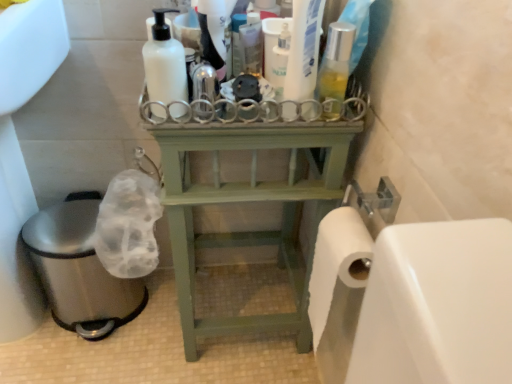
Measure the distance between point (314, 74) and camera.

Point (314, 74) and camera are 27.52 inches apart from each other.

Measure the distance between translucent plastic bottle at upper center, the 3th cleaning product when ordered from left to right, and camera.

A distance of 65.20 centimeters exists between translucent plastic bottle at upper center, the 3th cleaning product when ordered from left to right, and camera.

At what (x,y) coordinates should I click in order to perform the action: click on translucent plastic bottle at center, placed as the 4th cleaning product when sorted from left to right. Please return your answer as a coordinate pair (x, y). Looking at the image, I should click on (303, 50).

Which object is closer to the camera taking this photo, white matte bottle at upper center, which appears as the fourth cleaning product when viewed from the right, or translucent plastic bottle at upper center, which appears as the second cleaning product when viewed from the right?

white matte bottle at upper center, which appears as the fourth cleaning product when viewed from the right, is in front.

Is point (144, 45) less distant than point (280, 96)?

No, (144, 45) is further to viewer.

Is white matte bottle at upper center, the first cleaning product when ordered from left to right, facing towards translucent plastic bottle at upper center, which appears as the second cleaning product when viewed from the right?

No, white matte bottle at upper center, the first cleaning product when ordered from left to right, is not aimed at translucent plastic bottle at upper center, which appears as the second cleaning product when viewed from the right.

Is white matte bottle at upper center, the first cleaning product when ordered from left to right, smaller than translucent plastic bottle at upper center, which appears as the second cleaning product when viewed from the right?

No, white matte bottle at upper center, the first cleaning product when ordered from left to right, is not smaller than translucent plastic bottle at upper center, which appears as the second cleaning product when viewed from the right.

Can you confirm if translucent plastic bottle at center, placed as the 4th cleaning product when sorted from left to right, is bigger than translucent plastic spray bottle at center, which appears as the second cleaning product when viewed from the left?

Correct, translucent plastic bottle at center, placed as the 4th cleaning product when sorted from left to right, is larger in size than translucent plastic spray bottle at center, which appears as the second cleaning product when viewed from the left.

Would you consider translucent plastic bottle at center, placed as the 4th cleaning product when sorted from left to right, to be distant from translucent plastic spray bottle at center, which appears as the second cleaning product when viewed from the left?

No, there isn't a large distance between translucent plastic bottle at center, placed as the 4th cleaning product when sorted from left to right, and translucent plastic spray bottle at center, which appears as the second cleaning product when viewed from the left.

Does translucent plastic bottle at center, placed as the 4th cleaning product when sorted from left to right, have a greater width compared to translucent plastic spray bottle at center, which appears as the second cleaning product when viewed from the left?

No, translucent plastic bottle at center, placed as the 4th cleaning product when sorted from left to right, is not wider than translucent plastic spray bottle at center, which appears as the second cleaning product when viewed from the left.

Is translucent plastic bottle at center, the first cleaning product from the right, completely or partially outside of translucent plastic spray bottle at center, which appears as the second cleaning product when viewed from the left?

That's correct, translucent plastic bottle at center, the first cleaning product from the right, is outside of translucent plastic spray bottle at center, which appears as the second cleaning product when viewed from the left.

Locate an element on the screen. cleaning product that is the 2nd object directly below the translucent plastic spray bottle at center, which is the 3th cleaning product from right to left (from a real-world perspective) is located at coordinates (164, 63).

Considering the positions of points (209, 2) and (163, 22), is point (209, 2) farther from camera compared to point (163, 22)?

Yes.

Considering the positions of objects translucent plastic spray bottle at center, which is the 3th cleaning product from right to left, and white matte bottle at upper center, the first cleaning product when ordered from left to right, in the image provided, who is behind, translucent plastic spray bottle at center, which is the 3th cleaning product from right to left, or white matte bottle at upper center, the first cleaning product when ordered from left to right,?

translucent plastic spray bottle at center, which is the 3th cleaning product from right to left.

How far apart are translucent plastic spray bottle at center, which appears as the second cleaning product when viewed from the left, and white matte bottle at upper center, the first cleaning product when ordered from left to right?

They are 7.99 centimeters apart.

Considering the sizes of translucent plastic bottle at upper center, the 3th cleaning product when ordered from left to right, and translucent plastic spray bottle at center, which is the 3th cleaning product from right to left, in the image, is translucent plastic bottle at upper center, the 3th cleaning product when ordered from left to right, bigger or smaller than translucent plastic spray bottle at center, which is the 3th cleaning product from right to left,?

translucent plastic bottle at upper center, the 3th cleaning product when ordered from left to right, is smaller than translucent plastic spray bottle at center, which is the 3th cleaning product from right to left.

Is translucent plastic bottle at upper center, the 3th cleaning product when ordered from left to right, positioned behind translucent plastic spray bottle at center, which appears as the second cleaning product when viewed from the left?

Yes, it is behind translucent plastic spray bottle at center, which appears as the second cleaning product when viewed from the left.

In terms of height, does translucent plastic bottle at upper center, which appears as the second cleaning product when viewed from the right, look taller or shorter compared to translucent plastic spray bottle at center, which appears as the second cleaning product when viewed from the left?

translucent plastic bottle at upper center, which appears as the second cleaning product when viewed from the right, is shorter than translucent plastic spray bottle at center, which appears as the second cleaning product when viewed from the left.

Is translucent plastic bottle at upper center, the 3th cleaning product when ordered from left to right, completely or partially outside of translucent plastic spray bottle at center, which appears as the second cleaning product when viewed from the left?

That's correct, translucent plastic bottle at upper center, the 3th cleaning product when ordered from left to right, is outside of translucent plastic spray bottle at center, which appears as the second cleaning product when viewed from the left.

Consider the image. Does green wood shelf at center touch translucent plastic bottle at center, the first cleaning product from the right?

They are not placed beside each other.

Is green wood shelf at center at the left side of translucent plastic bottle at center, the first cleaning product from the right?

Yes, green wood shelf at center is to the left of translucent plastic bottle at center, the first cleaning product from the right.

Does point (352, 122) appear closer or farther from the camera than point (319, 0)?

Point (352, 122) appears to be farther away from the viewer than point (319, 0).

Which is more to the right, translucent plastic bottle at center, placed as the 4th cleaning product when sorted from left to right, or brushed metal sink at lower left?

translucent plastic bottle at center, placed as the 4th cleaning product when sorted from left to right.

What are the coordinates of `sink that appears below the translucent plastic bottle at center, placed as the 4th cleaning product when sorted from left to right (from a real-world perspective)` in the screenshot? It's located at (20, 149).

Is translucent plastic bottle at center, the first cleaning product from the right, shorter than brushed metal sink at lower left?

Correct, translucent plastic bottle at center, the first cleaning product from the right, is not as tall as brushed metal sink at lower left.

Where is `the 4th cleaning product behind when counting from the brushed metal sink at lower left`? The height and width of the screenshot is (384, 512). the 4th cleaning product behind when counting from the brushed metal sink at lower left is located at coordinates (280, 60).

From the image's perspective, is translucent plastic bottle at upper center, which appears as the second cleaning product when viewed from the right, below brushed metal sink at lower left?

No, from the image's perspective, translucent plastic bottle at upper center, which appears as the second cleaning product when viewed from the right, is not beneath brushed metal sink at lower left.

Is translucent plastic bottle at upper center, which appears as the second cleaning product when viewed from the right, far away from brushed metal sink at lower left?

Actually, translucent plastic bottle at upper center, which appears as the second cleaning product when viewed from the right, and brushed metal sink at lower left are a little close together.

Is translucent plastic bottle at upper center, the 3th cleaning product when ordered from left to right, oriented away from brushed metal sink at lower left?

translucent plastic bottle at upper center, the 3th cleaning product when ordered from left to right, does not have its back to brushed metal sink at lower left.

Where is `the 2nd cleaning product behind the white matte bottle at upper center, the first cleaning product when ordered from left to right`? the 2nd cleaning product behind the white matte bottle at upper center, the first cleaning product when ordered from left to right is located at coordinates (280, 60).

From the image's perspective, which cleaning product is the 1st one below the translucent plastic spray bottle at center, which is the 3th cleaning product from right to left? Please provide its 2D coordinates.

[(303, 50)]

Based on their spatial positions, is translucent plastic spray bottle at center, which is the 3th cleaning product from right to left, or brushed metal sink at lower left further from white matte bottle at upper center, which appears as the fourth cleaning product when viewed from the right?

brushed metal sink at lower left is positioned further to the anchor white matte bottle at upper center, which appears as the fourth cleaning product when viewed from the right.

Which object lies nearer to the anchor point translucent plastic bottle at center, placed as the 4th cleaning product when sorted from left to right, white matte bottle at upper center, which appears as the fourth cleaning product when viewed from the right, or green wood shelf at center?

white matte bottle at upper center, which appears as the fourth cleaning product when viewed from the right, is positioned closer to the anchor translucent plastic bottle at center, placed as the 4th cleaning product when sorted from left to right.

Which object lies nearer to the anchor point brushed metal sink at lower left, translucent plastic spray bottle at center, which is the 3th cleaning product from right to left, or translucent plastic bottle at center, placed as the 4th cleaning product when sorted from left to right?

translucent plastic spray bottle at center, which is the 3th cleaning product from right to left.

From the image, which object appears to be nearer to green wood shelf at center, translucent plastic bottle at center, the first cleaning product from the right, or translucent plastic bottle at upper center, the 3th cleaning product when ordered from left to right?

The object closer to green wood shelf at center is translucent plastic bottle at center, the first cleaning product from the right.

Which object lies nearer to the anchor point green wood shelf at center, brushed metal sink at lower left or translucent plastic spray bottle at center, which appears as the second cleaning product when viewed from the left?

translucent plastic spray bottle at center, which appears as the second cleaning product when viewed from the left, is closer to green wood shelf at center.

When comparing their distances from translucent plastic bottle at center, the first cleaning product from the right, does green wood shelf at center or translucent plastic spray bottle at center, which appears as the second cleaning product when viewed from the left, seem further?

Among the two, green wood shelf at center is located further to translucent plastic bottle at center, the first cleaning product from the right.

Based on their spatial positions, is translucent plastic bottle at upper center, which appears as the second cleaning product when viewed from the right, or translucent plastic spray bottle at center, which appears as the second cleaning product when viewed from the left, closer to translucent plastic bottle at center, the first cleaning product from the right?

translucent plastic bottle at upper center, which appears as the second cleaning product when viewed from the right, is closer to translucent plastic bottle at center, the first cleaning product from the right.

Considering their positions, is brushed metal sink at lower left positioned closer to translucent plastic spray bottle at center, which appears as the second cleaning product when viewed from the left, than translucent plastic bottle at upper center, which appears as the second cleaning product when viewed from the right?

Based on the image, translucent plastic bottle at upper center, which appears as the second cleaning product when viewed from the right, appears to be nearer to translucent plastic spray bottle at center, which appears as the second cleaning product when viewed from the left.

Where is `cleaning product between translucent plastic bottle at upper center, which appears as the second cleaning product when viewed from the right, and green wood shelf at center in the up-down direction`? The image size is (512, 384). cleaning product between translucent plastic bottle at upper center, which appears as the second cleaning product when viewed from the right, and green wood shelf at center in the up-down direction is located at coordinates (164, 63).

The image size is (512, 384). In order to click on furniture between brushed metal sink at lower left and translucent plastic bottle at center, the first cleaning product from the right, in the horizontal direction in this screenshot , I will do `click(249, 195)`.

You are a GUI agent. You are given a task and a screenshot of the screen. Output one action in this format:
    pyautogui.click(x=<x>, y=<y>)
    Task: Click on the cleaning product between white matte bottle at upper center, the first cleaning product when ordered from left to right, and translucent plastic bottle at upper center, which appears as the second cleaning product when viewed from the right
    This screenshot has width=512, height=384.
    Given the screenshot: What is the action you would take?
    [x=213, y=33]

Find the location of a particular element. Image resolution: width=512 pixels, height=384 pixels. cleaning product between translucent plastic spray bottle at center, which is the 3th cleaning product from right to left, and translucent plastic bottle at center, placed as the 4th cleaning product when sorted from left to right is located at coordinates (280, 60).